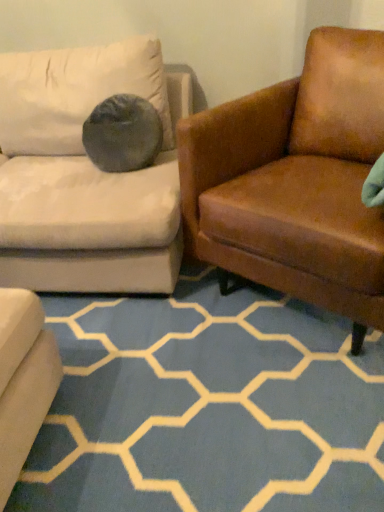
Image resolution: width=384 pixels, height=512 pixels. In order to click on blue carpet at center in this screenshot , I will do `click(207, 406)`.

The width and height of the screenshot is (384, 512). What do you see at coordinates (207, 406) in the screenshot?
I see `blue carpet at center` at bounding box center [207, 406].

The height and width of the screenshot is (512, 384). Describe the element at coordinates (295, 180) in the screenshot. I see `brown leather armchair at right` at that location.

Locate an element on the screen. brown leather armchair at right is located at coordinates (295, 180).

You are a GUI agent. You are given a task and a screenshot of the screen. Output one action in this format:
    pyautogui.click(x=<x>, y=<y>)
    Task: Click on the blue carpet at center
    
    Given the screenshot: What is the action you would take?
    pyautogui.click(x=207, y=406)

Is blue carpet at center at the right side of brown leather armchair at right?

In fact, blue carpet at center is to the left of brown leather armchair at right.

Which object is closer to the camera taking this photo, blue carpet at center or brown leather armchair at right?

brown leather armchair at right is more forward.

Is point (130, 402) positioned in front of point (282, 103)?

Yes, it is in front of point (282, 103).

From the image's perspective, is blue carpet at center above brown leather armchair at right?

Incorrect, from the image's perspective, blue carpet at center is lower than brown leather armchair at right.

From a real-world perspective, is blue carpet at center above or below brown leather armchair at right?

blue carpet at center is situated lower than brown leather armchair at right in the real world.

Does blue carpet at center have a lesser width compared to brown leather armchair at right?

Correct, the width of blue carpet at center is less than that of brown leather armchair at right.

Which of these two, blue carpet at center or brown leather armchair at right, stands shorter?

Standing shorter between the two is blue carpet at center.

Does blue carpet at center have a smaller size compared to brown leather armchair at right?

Yes, blue carpet at center is smaller than brown leather armchair at right.

Is blue carpet at center situated inside brown leather armchair at right or outside?

blue carpet at center is not enclosed by brown leather armchair at right.

Would you consider blue carpet at center to be distant from brown leather armchair at right?

blue carpet at center is near brown leather armchair at right, not far away.

Does blue carpet at center turn towards brown leather armchair at right?

No, blue carpet at center is not facing towards brown leather armchair at right.

How far apart are blue carpet at center and brown leather armchair at right?

The distance of blue carpet at center from brown leather armchair at right is 18.14 inches.

The image size is (384, 512). What are the coordinates of `pattern located below the brown leather armchair at right (from the image's perspective)` in the screenshot? It's located at (207, 406).

Between brown leather armchair at right and blue carpet at center, which one appears on the right side from the viewer's perspective?

brown leather armchair at right.

Is the depth of brown leather armchair at right greater than that of blue carpet at center?

No, the depth of brown leather armchair at right is less than that of blue carpet at center.

Does point (324, 221) come behind point (150, 441)?

Yes, it is.

From the image's perspective, between brown leather armchair at right and blue carpet at center, which one is located above?

brown leather armchair at right, from the image's perspective.

From a real-world perspective, is brown leather armchair at right below blue carpet at center?

No, from a real-world perspective, brown leather armchair at right is not under blue carpet at center.

Considering the sizes of brown leather armchair at right and blue carpet at center in the image, is brown leather armchair at right wider or thinner than blue carpet at center?

In the image, brown leather armchair at right appears to be wider than blue carpet at center.

Considering the relative sizes of brown leather armchair at right and blue carpet at center in the image provided, is brown leather armchair at right shorter than blue carpet at center?

No, brown leather armchair at right is not shorter than blue carpet at center.

Who is bigger, brown leather armchair at right or blue carpet at center?

With larger size is brown leather armchair at right.

Is brown leather armchair at right situated inside blue carpet at center or outside?

brown leather armchair at right is not enclosed by blue carpet at center.

Is there a large distance between brown leather armchair at right and blue carpet at center?

brown leather armchair at right is near blue carpet at center, not far away.

Consider the image. Does brown leather armchair at right turn towards blue carpet at center?

Yes, brown leather armchair at right is turned towards blue carpet at center.

Identify the location of pattern directly beneath the brown leather armchair at right (from a real-world perspective). Image resolution: width=384 pixels, height=512 pixels. (207, 406).

Find the location of `studio couch that appears above the blue carpet at center (from the image's perspective)`. studio couch that appears above the blue carpet at center (from the image's perspective) is located at coordinates (295, 180).

The image size is (384, 512). What are the coordinates of `pattern that is on the left side of brown leather armchair at right` in the screenshot? It's located at (207, 406).